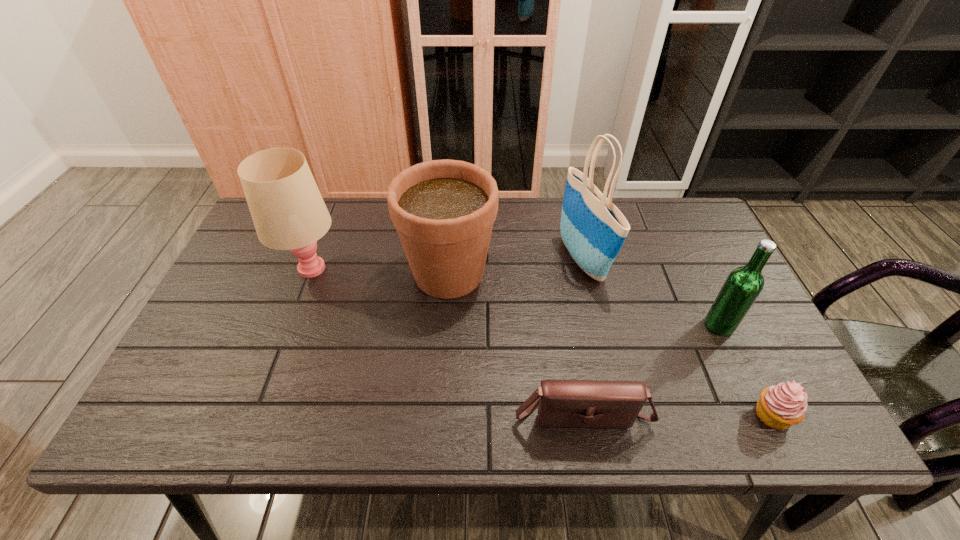
What are the coordinates of `free space located on the left of the shortest object` in the screenshot? It's located at (626, 415).

This screenshot has height=540, width=960. I want to click on tote bag that is at the far edge, so pyautogui.click(x=593, y=229).

At what (x,y) coordinates should I click in order to perform the action: click on lampshade that is at the far edge. Please return your answer as a coordinate pair (x, y). The height and width of the screenshot is (540, 960). Looking at the image, I should click on (288, 212).

The width and height of the screenshot is (960, 540). Identify the location of flowerpot positioned at the far edge. (443, 210).

The width and height of the screenshot is (960, 540). Find the location of `shoulder bag that is at the near edge`. shoulder bag that is at the near edge is located at coordinates (562, 403).

Identify the location of cupcake at the near edge. pyautogui.click(x=779, y=407).

Where is `object present at the left edge`? The width and height of the screenshot is (960, 540). object present at the left edge is located at coordinates (288, 212).

Where is `beer bottle that is at the right edge`? The height and width of the screenshot is (540, 960). beer bottle that is at the right edge is located at coordinates (744, 284).

At what (x,y) coordinates should I click in order to perform the action: click on cupcake positioned at the right edge. Please return your answer as a coordinate pair (x, y). Looking at the image, I should click on (779, 407).

The height and width of the screenshot is (540, 960). Identify the location of object that is positioned at the far left corner. (288, 212).